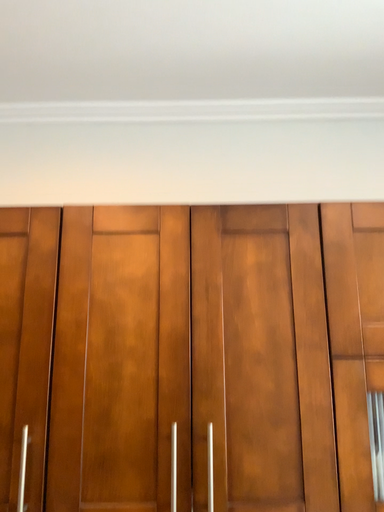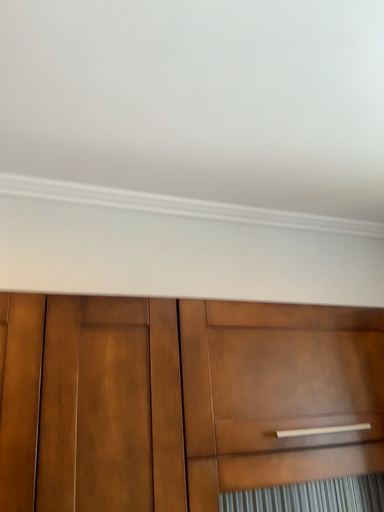
Question: Which way did the camera rotate in the video?

Choices:
 (A) rotated downward
 (B) rotated upward

Answer: (B)